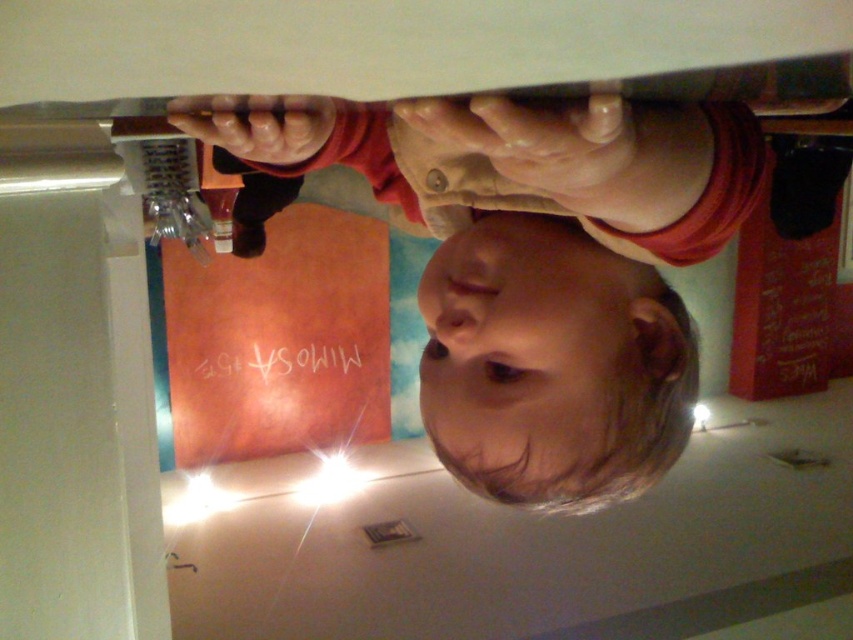
Question: Can you confirm if smooth skin child at center is smaller than smooth skin head at center?

Choices:
 (A) no
 (B) yes

Answer: (A)

Question: Which point appears closest to the camera in this image?

Choices:
 (A) (477, 300)
 (B) (451, 276)

Answer: (A)

Question: Which point is farther to the camera?

Choices:
 (A) matte red shirt at upper center
 (B) smooth skin head at center
 (C) smooth skin child at center

Answer: (B)

Question: Can you confirm if smooth skin child at center is positioned to the left of matte red shirt at upper center?

Choices:
 (A) no
 (B) yes

Answer: (A)

Question: Does smooth skin child at center appear on the right side of smooth skin head at center?

Choices:
 (A) yes
 (B) no

Answer: (B)

Question: Which point is closer to the camera taking this photo?

Choices:
 (A) (663, 252)
 (B) (604, 189)
 (C) (537, 454)

Answer: (B)